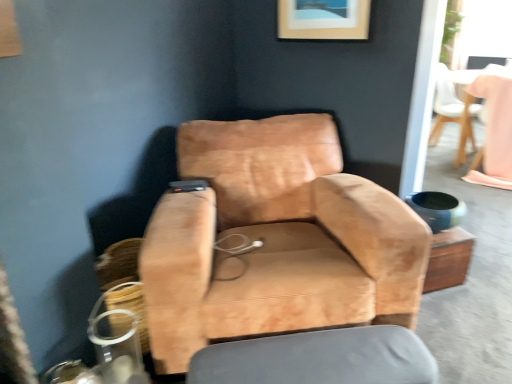
Question: In terms of size, does wooden picture frame at upper center appear bigger or smaller than suede tan chair at center, which ranks as the 1th chair in bottom-to-top order?

Choices:
 (A) small
 (B) big

Answer: (A)

Question: Would you say wooden picture frame at upper center is inside or outside suede tan chair at center, the first chair positioned from the front?

Choices:
 (A) inside
 (B) outside

Answer: (B)

Question: Which object is positioned closest to the suede tan chair at center, which appears as the 1th chair when viewed from the left?

Choices:
 (A) pink fabric table at upper right
 (B) light brown leather chair at upper right, which is the first chair in back-to-front order
 (C) smooth gray cushion at lower center
 (D) wooden picture frame at upper center

Answer: (C)

Question: Which of these objects is positioned closest to the light brown leather chair at upper right, positioned as the first chair in right-to-left order?

Choices:
 (A) suede tan chair at center, which appears as the 1th chair when viewed from the left
 (B) wooden picture frame at upper center
 (C) pink fabric table at upper right
 (D) smooth gray cushion at lower center

Answer: (C)